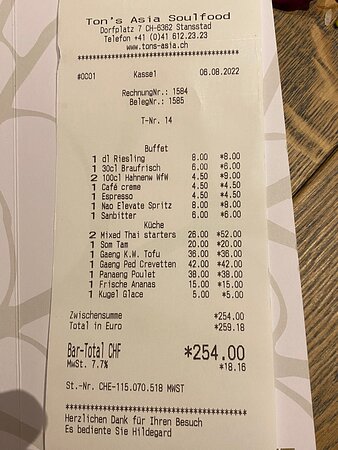
You are a GUI agent. You are given a task and a screenshot of the screen. Output one action in this format:
    pyautogui.click(x=<x>, y=<y>)
    Task: Click on the table
    
    Given the screenshot: What is the action you would take?
    pyautogui.click(x=321, y=338)